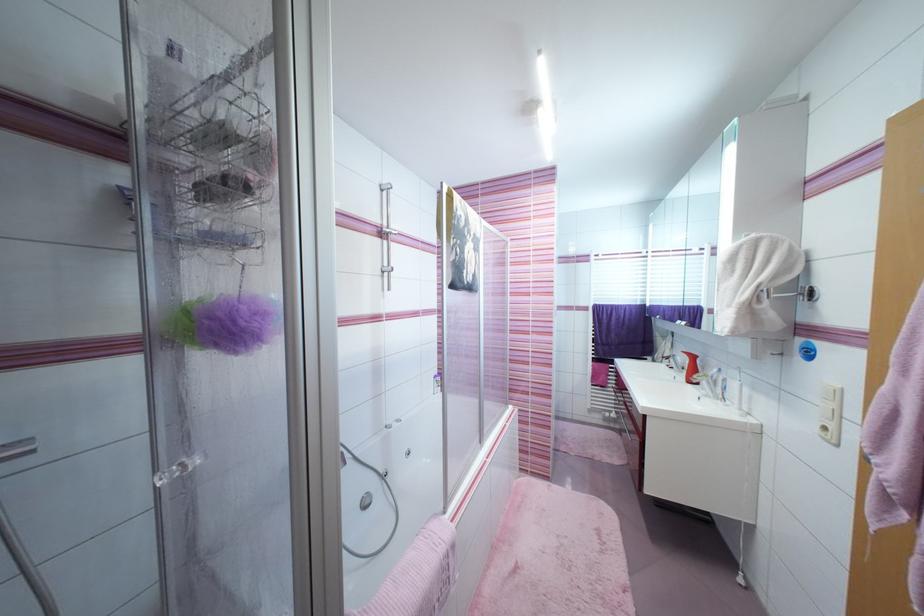
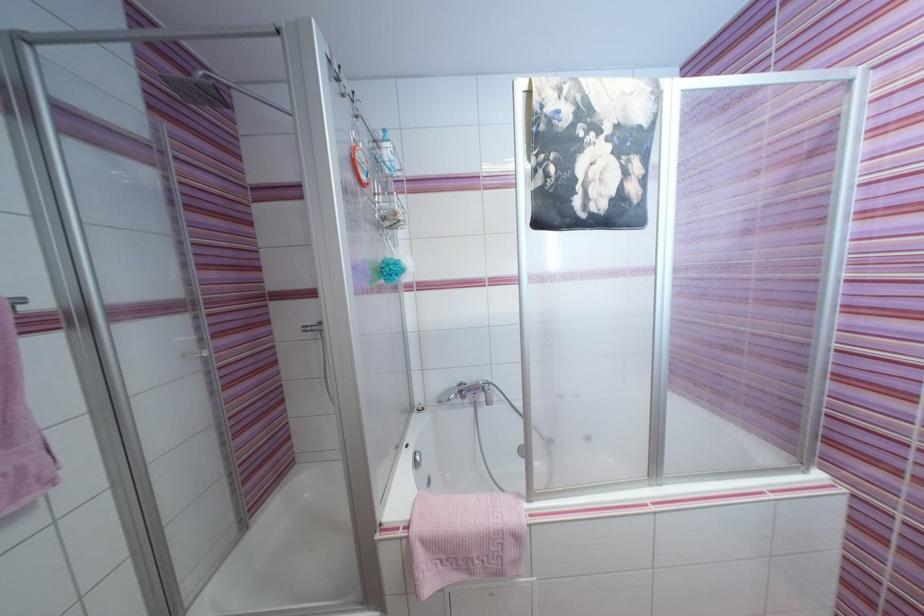
Question: The camera is either moving clockwise (left) or counter-clockwise (right) around the object. The first image is from the beginning of the video and the second image is from the end. Is the camera moving left or right when shooting the video?

Choices:
 (A) Left
 (B) Right

Answer: (B)